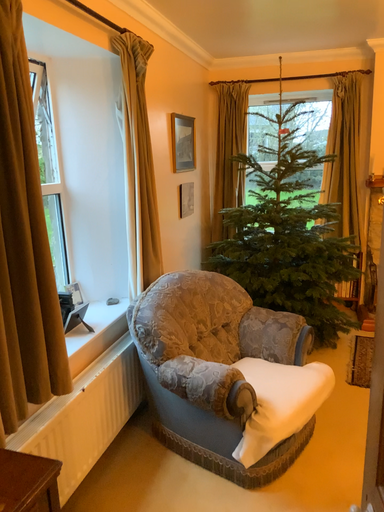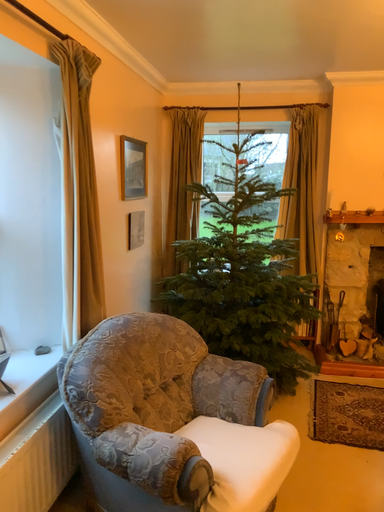
Question: Which way did the camera rotate in the video?

Choices:
 (A) rotated left
 (B) rotated right

Answer: (B)